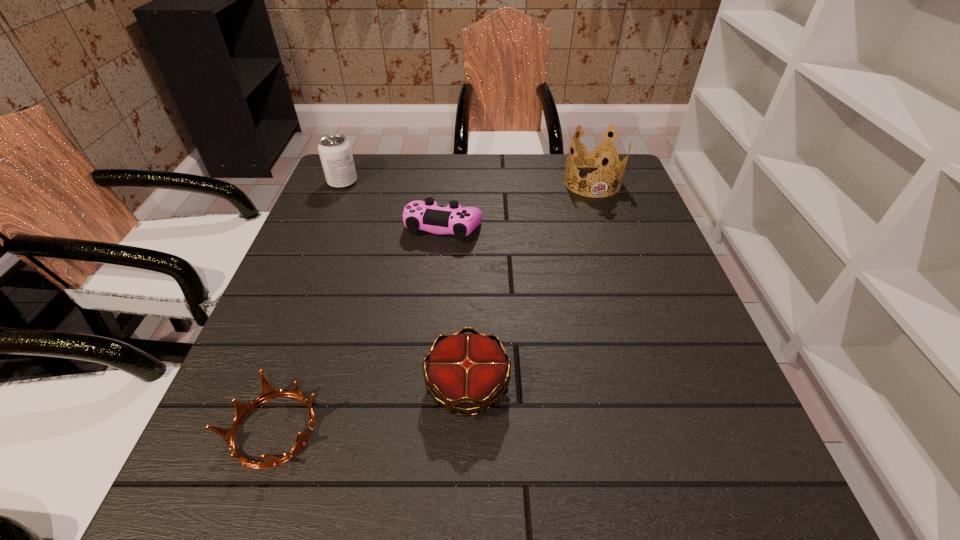
This screenshot has height=540, width=960. I want to click on free spot between the shortest crown and the soda can, so click(x=308, y=306).

Identify the location of free spot between the second tallest crown and the leftmost crown. The height and width of the screenshot is (540, 960). (372, 408).

Identify the location of vacant region between the farthest crown and the soda can. click(x=468, y=182).

Find the location of `free spot between the shortest crown and the soda can`. free spot between the shortest crown and the soda can is located at coordinates (308, 306).

Where is `free spot between the soda can and the control`? The image size is (960, 540). free spot between the soda can and the control is located at coordinates (394, 205).

Find the location of a particular element. This screenshot has width=960, height=540. vacant space in between the farthest crown and the shortest object is located at coordinates (433, 306).

Find the location of a particular element. The height and width of the screenshot is (540, 960). unoccupied area between the farthest crown and the soda can is located at coordinates (468, 182).

Locate which object ranks in proximity to the second tallest crown. Please provide its 2D coordinates. Your answer should be formatted as a tuple, i.e. [(x, y)], where the tuple contains the x and y coordinates of a point satisfying the conditions above.

[(268, 392)]

Locate an element on the screen. the third closest object relative to the second tallest crown is located at coordinates (597, 155).

I want to click on the closest crown to the second crown from right to left, so click(268, 392).